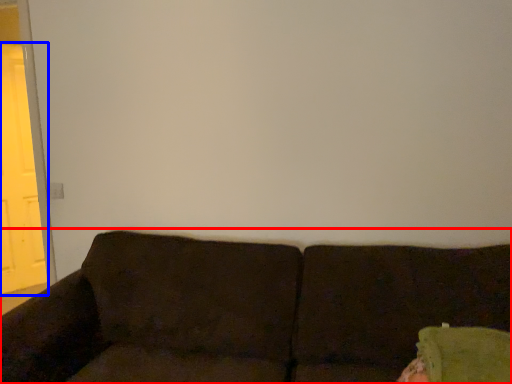
Question: Which object is further to the camera taking this photo, studio couch (highlighted by a red box) or screen door (highlighted by a blue box)?

Choices:
 (A) studio couch
 (B) screen door

Answer: (B)